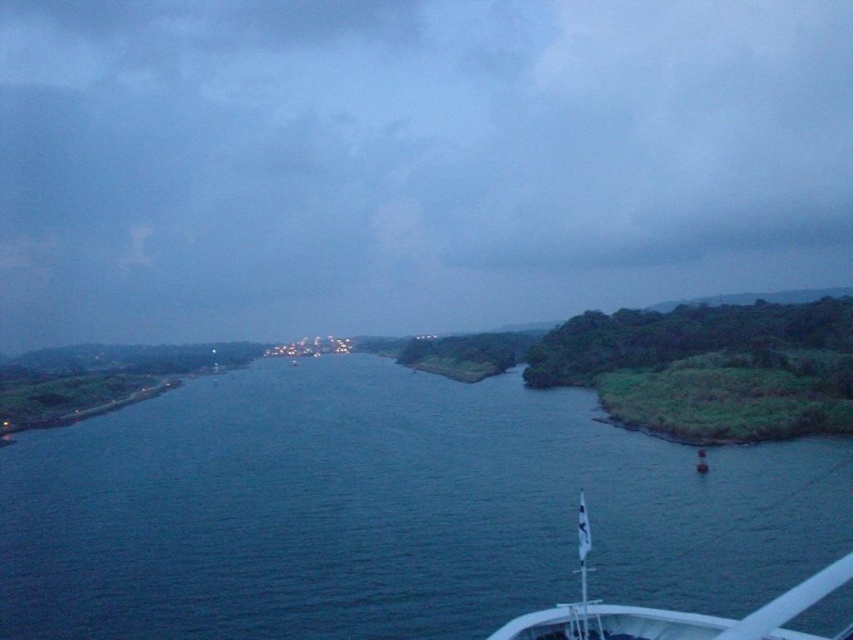
You are standing on the riverbank and want to place a small boat in the water. According to the coordinates provided, where should you position the boat to ensure it floats in the dark blue water at center?

The dark blue water at center is located at point (387, 509), so you should position the boat at those coordinates to ensure it floats in the dark blue water at center.